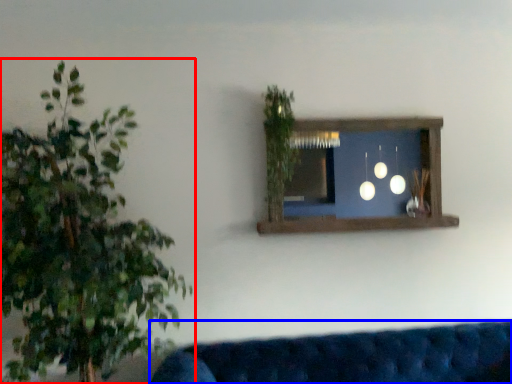
Question: Which object is closer to the camera taking this photo, houseplant (highlighted by a red box) or studio couch (highlighted by a blue box)?

Choices:
 (A) houseplant
 (B) studio couch

Answer: (A)